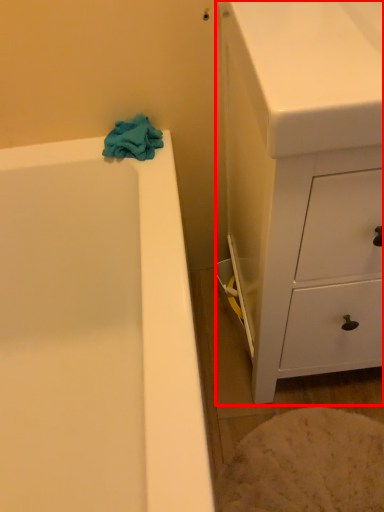
Question: Considering the relative positions of chest of drawers (annotated by the red box) and bath towel in the image provided, where is chest of drawers (annotated by the red box) located with respect to the staircase?

Choices:
 (A) right
 (B) left

Answer: (A)